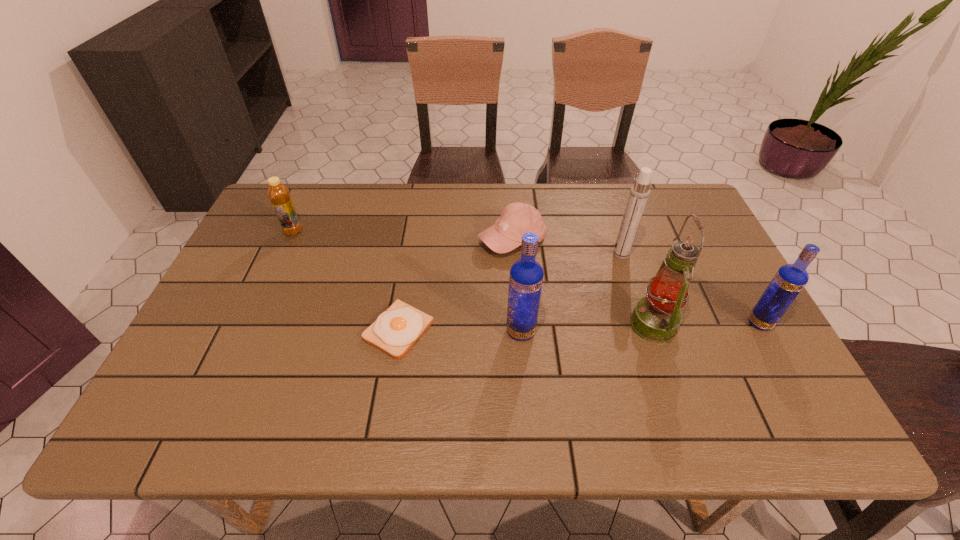
Where is `object present at the left edge`? Image resolution: width=960 pixels, height=540 pixels. object present at the left edge is located at coordinates (279, 195).

The image size is (960, 540). I want to click on object that is at the right edge, so click(790, 279).

Identify the location of object that is at the far left corner. The height and width of the screenshot is (540, 960). 279,195.

The height and width of the screenshot is (540, 960). I want to click on vacant space at the far edge of the desktop, so click(x=577, y=205).

Locate an element on the screen. This screenshot has height=540, width=960. free point at the near edge is located at coordinates (502, 386).

This screenshot has height=540, width=960. I want to click on free space at the left edge of the desktop, so click(250, 241).

Where is `free space at the right edge of the desktop`? The width and height of the screenshot is (960, 540). free space at the right edge of the desktop is located at coordinates (711, 319).

The height and width of the screenshot is (540, 960). I want to click on vacant space at the far right corner of the desktop, so click(x=653, y=225).

Find the location of a particular element. This screenshot has height=540, width=960. vacant area that lies between the right vodka and the sixth object from right to left is located at coordinates (579, 326).

You are a GUI agent. You are given a task and a screenshot of the screen. Output one action in this format:
    pyautogui.click(x=<x>, y=<y>)
    Task: Click on the free space between the third shortest object and the oil lamp
    The width and height of the screenshot is (960, 540).
    Given the screenshot: What is the action you would take?
    pyautogui.click(x=473, y=278)